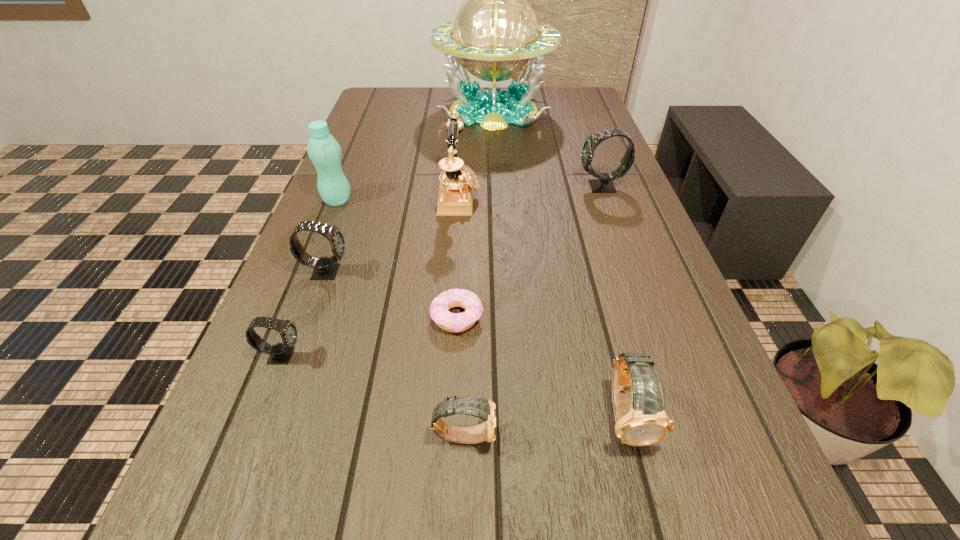
The image size is (960, 540). Find the location of `vacant space located on the face of the farthest watch`. vacant space located on the face of the farthest watch is located at coordinates (515, 187).

Image resolution: width=960 pixels, height=540 pixels. Find the location of `vacant area located on the face of the second farthest gray watch`. vacant area located on the face of the second farthest gray watch is located at coordinates (x=384, y=272).

Where is `vacant space located 0.050m on the face of the right gold watch`? Image resolution: width=960 pixels, height=540 pixels. vacant space located 0.050m on the face of the right gold watch is located at coordinates (646, 492).

The image size is (960, 540). Identify the location of vacant space located on the face of the left gold watch. (590, 435).

Locate an element on the screen. The image size is (960, 540). free space located 0.050m on the face of the nearest gray watch is located at coordinates (x=332, y=355).

Where is `vacant region located 0.190m on the right of the doughnut`? This screenshot has height=540, width=960. vacant region located 0.190m on the right of the doughnut is located at coordinates (587, 317).

Identify the location of object located at the far edge. (495, 35).

The width and height of the screenshot is (960, 540). In order to click on bottle present at the left edge in this screenshot , I will do `click(324, 151)`.

The height and width of the screenshot is (540, 960). I want to click on globe that is at the right edge, so click(x=495, y=35).

Locate an element on the screen. The height and width of the screenshot is (540, 960). object present at the far right corner is located at coordinates (495, 35).